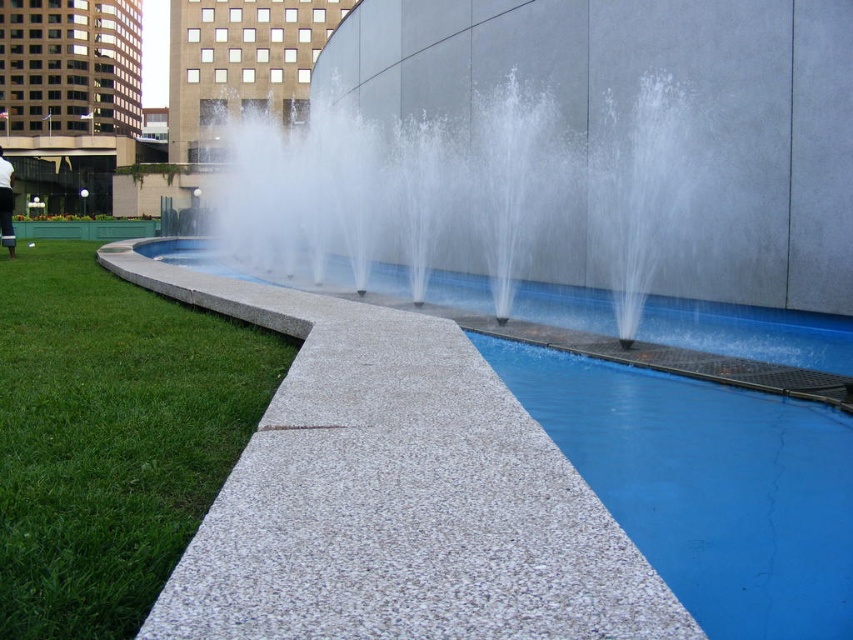
Question: Where is green grass at lower left located in relation to clear glass water at center in the image?

Choices:
 (A) above
 (B) below

Answer: (B)

Question: Among these points, which one is farthest from the camera?

Choices:
 (A) (786, 349)
 (B) (520, 106)
 (C) (83, 605)

Answer: (B)

Question: Which object is positioned farthest from the blue polished concrete pool at center?

Choices:
 (A) white cotton shirt at lower left
 (B) blue speckled concrete pool at lower right

Answer: (A)

Question: Which of the following is the closest to the observer?

Choices:
 (A) blue polished concrete pool at center
 (B) blue speckled concrete pool at lower right
 (C) white cotton shirt at lower left
 (D) clear glass water at center

Answer: (B)

Question: Is green grass at lower left below blue speckled concrete pool at lower right?

Choices:
 (A) no
 (B) yes

Answer: (A)

Question: Does green grass at lower left appear on the right side of white cotton shirt at lower left?

Choices:
 (A) no
 (B) yes

Answer: (B)